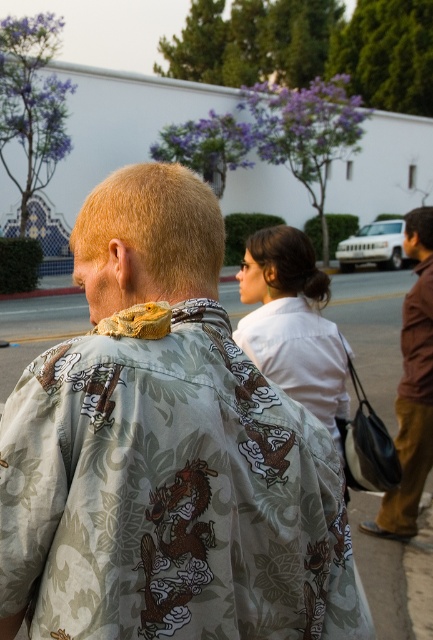
Is point (174, 240) less distant than point (252, 248)?

Yes, it is.

Who is positioned more to the left, printed fabric shirt at center or white cotton shirt at center?

Positioned to the left is printed fabric shirt at center.

Is point (32, 480) positioned in front of point (294, 236)?

Yes.

Find the location of a particular element. The width and height of the screenshot is (433, 640). printed fabric shirt at center is located at coordinates (167, 454).

Does printed fabric shirt at center have a larger size compared to brown leather bag at right?

No, printed fabric shirt at center is not bigger than brown leather bag at right.

Who is lower down, printed fabric shirt at center or brown leather bag at right?

printed fabric shirt at center is lower down.

Find the location of a particular element. The height and width of the screenshot is (640, 433). printed fabric shirt at center is located at coordinates (167, 454).

Where is `printed fabric shirt at center`? The width and height of the screenshot is (433, 640). printed fabric shirt at center is located at coordinates (167, 454).

Who is positioned more to the left, white cotton shirt at center or brown leather bag at right?

From the viewer's perspective, white cotton shirt at center appears more on the left side.

Who is more forward, (x=235, y=336) or (x=394, y=490)?

Point (x=235, y=336) is in front.

Which is in front, point (272, 259) or point (416, 221)?

Point (272, 259)

At what (x,y) coordinates should I click in order to perform the action: click on white cotton shirt at center. Please return your answer as a coordinate pair (x, y). This screenshot has height=640, width=433. Looking at the image, I should click on (293, 323).